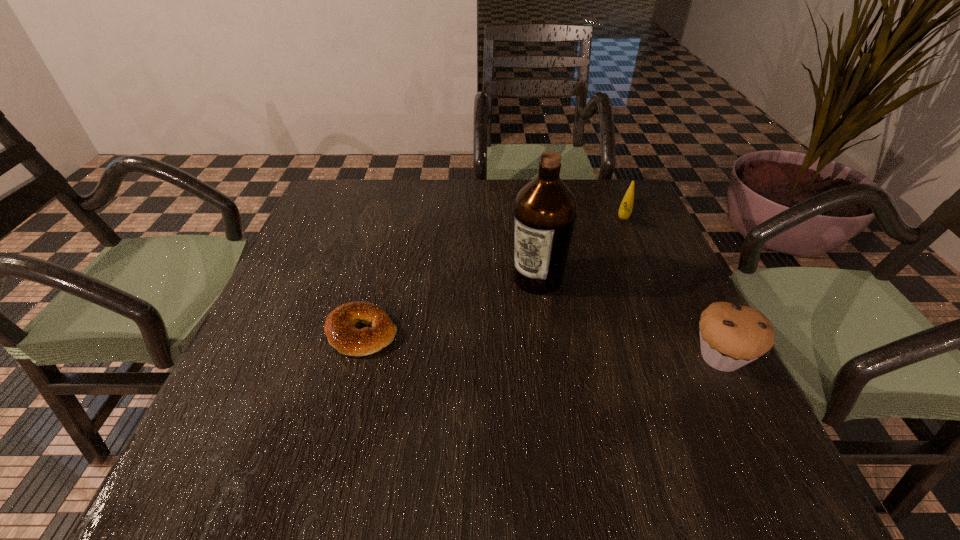
At what (x,y) coordinates should I click in order to perform the action: click on object present at the far right corner. Please return your answer as a coordinate pair (x, y). This screenshot has width=960, height=540. Looking at the image, I should click on point(625,210).

Where is `object that is at the near right corner`? The width and height of the screenshot is (960, 540). object that is at the near right corner is located at coordinates (731, 335).

The width and height of the screenshot is (960, 540). In the image, there is a desktop. Find the location of `blank space at the far edge`. blank space at the far edge is located at coordinates (583, 223).

Where is `free spot at the near edge of the desktop`? free spot at the near edge of the desktop is located at coordinates (424, 408).

You are a GUI agent. You are given a task and a screenshot of the screen. Output one action in this format:
    pyautogui.click(x=<x>, y=<y>)
    Task: Click on the vacant space at the left edge of the desktop
    
    Given the screenshot: What is the action you would take?
    pyautogui.click(x=291, y=274)

You are a GUI agent. You are given a task and a screenshot of the screen. Output one action in this format:
    pyautogui.click(x=<x>, y=<y>)
    Task: Click on the free region at the right edge of the desktop
    
    Given the screenshot: What is the action you would take?
    pyautogui.click(x=610, y=227)

In the image, there is a desktop. Identify the location of free space at the far left corner. (352, 196).

You are a GUI agent. You are given a task and a screenshot of the screen. Output one action in this format:
    pyautogui.click(x=<x>, y=<y>)
    Task: Click on the vacant space at the near left corner
    This screenshot has height=540, width=960.
    Given the screenshot: What is the action you would take?
    pyautogui.click(x=279, y=387)

Identify the location of vacant space at the far right corner. (596, 218).

Where is `blank region between the second object from left to right and the third tallest object`? The width and height of the screenshot is (960, 540). blank region between the second object from left to right and the third tallest object is located at coordinates (581, 246).